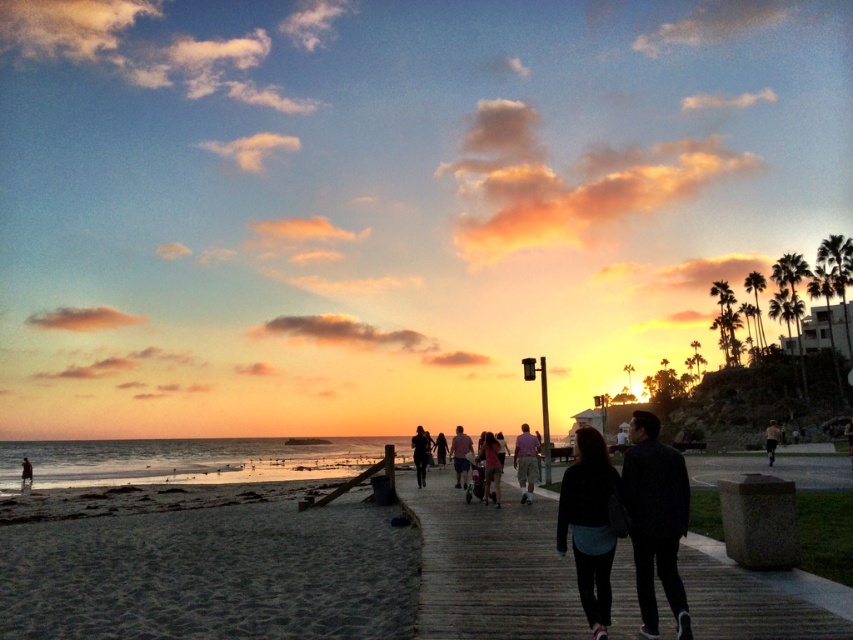
Question: Is dark blue sweater at center closer to camera compared to light pink shirt at center?

Choices:
 (A) yes
 (B) no

Answer: (A)

Question: Which is nearer to the dark blue stroller at center?

Choices:
 (A) skinny jeans at center
 (B) dark brown coat at lower left

Answer: (A)

Question: Which point appears farthest from the camera in this image?

Choices:
 (A) (451, 452)
 (B) (575, 477)
 (C) (772, 444)

Answer: (C)

Question: Is dark blue sweater at center thinner than dark blue jeans at center?

Choices:
 (A) no
 (B) yes

Answer: (A)

Question: Among these objects, which one is farthest from the camera?

Choices:
 (A) light pink cotton shirt at center
 (B) pink cotton shirt at center
 (C) light pink shirt at center

Answer: (B)

Question: Is the position of pink cotton shirt at center less distant than that of skinny jeans at center?

Choices:
 (A) no
 (B) yes

Answer: (B)